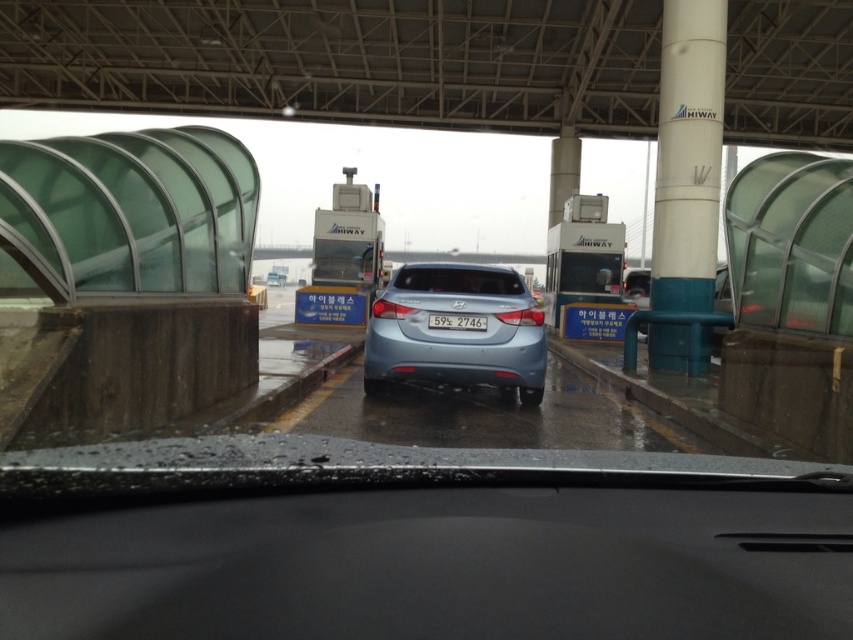
Is the position of satin blue sedan at center more distant than that of semi-glossy blue car at center?

No, it is in front of semi-glossy blue car at center.

Locate an element on the screen. This screenshot has height=640, width=853. satin blue sedan at center is located at coordinates (456, 330).

Who is more forward, (523, 323) or (459, 275)?

Point (523, 323) is in front.

Find the location of `satin blue sedan at center`. satin blue sedan at center is located at coordinates (456, 330).

Between white glossy pole at upper right and white plastic license plate at center, which one has less height?

Standing shorter between the two is white plastic license plate at center.

Is white glossy pole at upper right below white plastic license plate at center?

No, white glossy pole at upper right is not below white plastic license plate at center.

Image resolution: width=853 pixels, height=640 pixels. I want to click on white glossy pole at upper right, so click(688, 156).

Is white glossy pole at upper right taller than semi-glossy blue car at center?

Correct, white glossy pole at upper right is much taller as semi-glossy blue car at center.

Is white glossy pole at upper right in front of semi-glossy blue car at center?

No, it is not.

Which is in front, point (688, 58) or point (405, 273)?

Point (405, 273)

You are a GUI agent. You are given a task and a screenshot of the screen. Output one action in this format:
    pyautogui.click(x=<x>, y=<y>)
    Task: Click on the white glossy pole at upper right
    
    Given the screenshot: What is the action you would take?
    pyautogui.click(x=688, y=156)